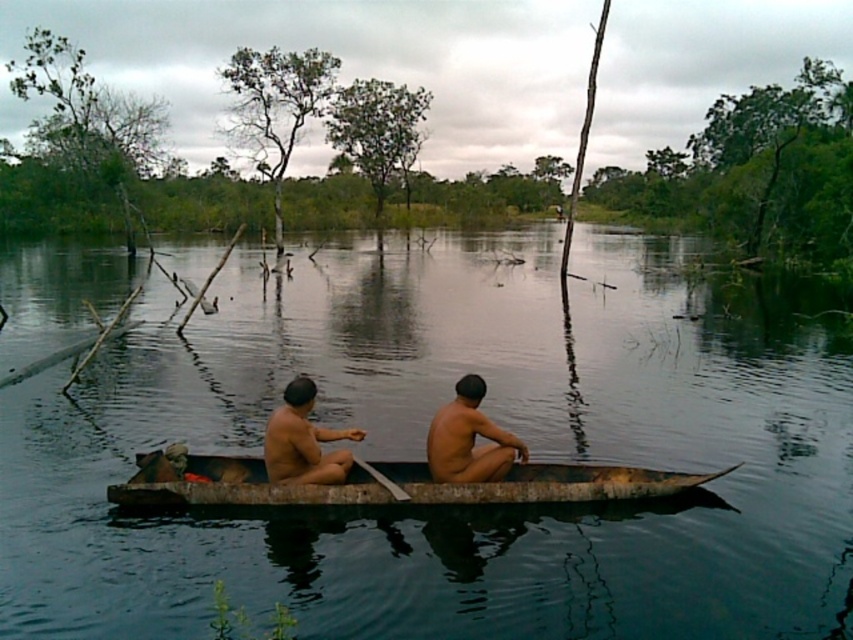
Question: Can you confirm if naked skin at center is positioned to the left of brown skin man at center?

Choices:
 (A) yes
 (B) no

Answer: (B)

Question: Can you confirm if naked skin at center is positioned below brown skin man at center?

Choices:
 (A) yes
 (B) no

Answer: (B)

Question: Which point is closer to the camera taking this photo?

Choices:
 (A) (525, 490)
 (B) (363, 433)
 (C) (358, 461)

Answer: (B)

Question: Based on their relative distances, which object is farther from the wooden paddle at center?

Choices:
 (A) wooden canoe at center
 (B) greenish-brown water at center
 (C) brown skin man at center

Answer: (B)

Question: Which point appears farthest from the camera in this image?

Choices:
 (A) (123, 500)
 (B) (361, 465)
 (C) (274, 472)

Answer: (B)

Question: Does wooden canoe at center appear on the left side of brown skin man at center?

Choices:
 (A) yes
 (B) no

Answer: (B)